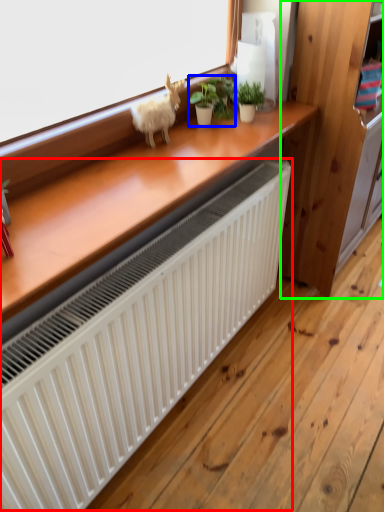
Question: Which object is the closest to the radiator (highlighted by a red box)? Choose among these: houseplant (highlighted by a blue box) or dresser (highlighted by a green box).

Choices:
 (A) houseplant
 (B) dresser

Answer: (A)